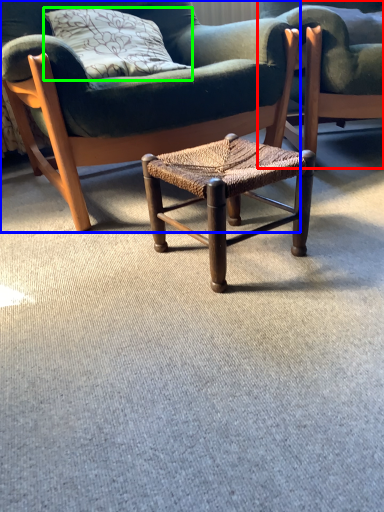
Question: Which object is the closest to the chair (highlighted by a red box)? Choose among these: chair (highlighted by a blue box) or pillow (highlighted by a green box).

Choices:
 (A) chair
 (B) pillow

Answer: (A)